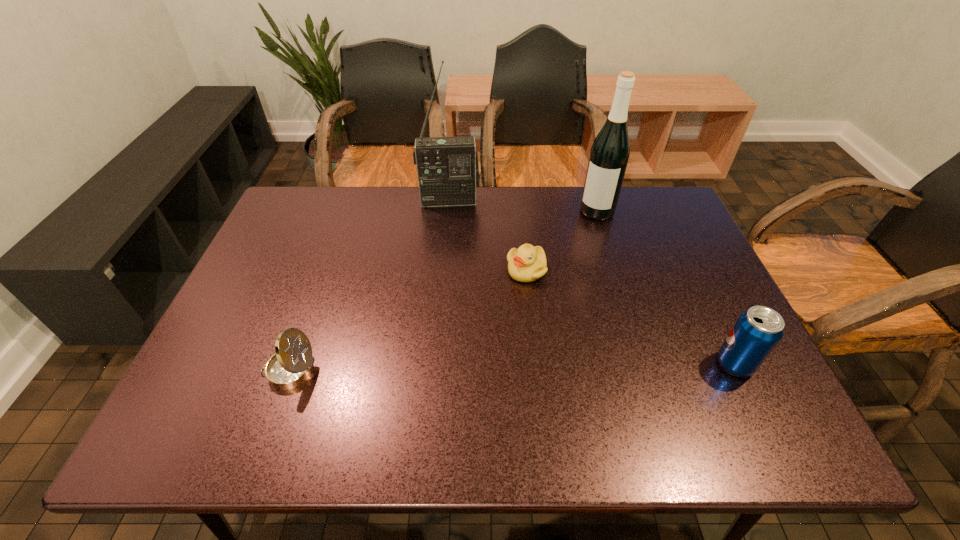
You are a GUI agent. You are given a task and a screenshot of the screen. Output one action in this format:
    pyautogui.click(x=<x>, y=<y>)
    Task: Click on the vacant region located 0.380m at the face of the shortest object
    
    Given the screenshot: What is the action you would take?
    pyautogui.click(x=450, y=400)

This screenshot has height=540, width=960. I want to click on free spot located 0.110m at the face of the shortest object, so [x=502, y=312].

Identify the location of blank space located at the face of the shortest object. The height and width of the screenshot is (540, 960). (491, 332).

At what (x,y) coordinates should I click in order to perform the action: click on vacant point located 0.380m on the label of the fourth object from left to right. Please return your answer as a coordinate pair (x, y). Image resolution: width=960 pixels, height=540 pixels. Looking at the image, I should click on (546, 302).

You are a GUI agent. You are given a task and a screenshot of the screen. Output one action in this format:
    pyautogui.click(x=<x>, y=<y>)
    Task: Click on the free space located on the label of the fourth object from left to right
    This screenshot has height=540, width=960.
    Given the screenshot: What is the action you would take?
    pyautogui.click(x=568, y=262)

The height and width of the screenshot is (540, 960). In order to click on free location located 0.330m on the label of the fourth object from left to right in this screenshot , I will do `click(553, 290)`.

Locate an element on the screen. Image resolution: width=960 pixels, height=540 pixels. vacant region located 0.320m on the display of the fourth object from right to left is located at coordinates (453, 279).

Identify the location of vacant space located on the display of the fourth object from right to left. Image resolution: width=960 pixels, height=540 pixels. (451, 242).

Where is `vacant space located on the display of the fourth object from right to left`? This screenshot has width=960, height=540. vacant space located on the display of the fourth object from right to left is located at coordinates (451, 227).

Where is `wine bottle located at the far edge`? The image size is (960, 540). wine bottle located at the far edge is located at coordinates (609, 154).